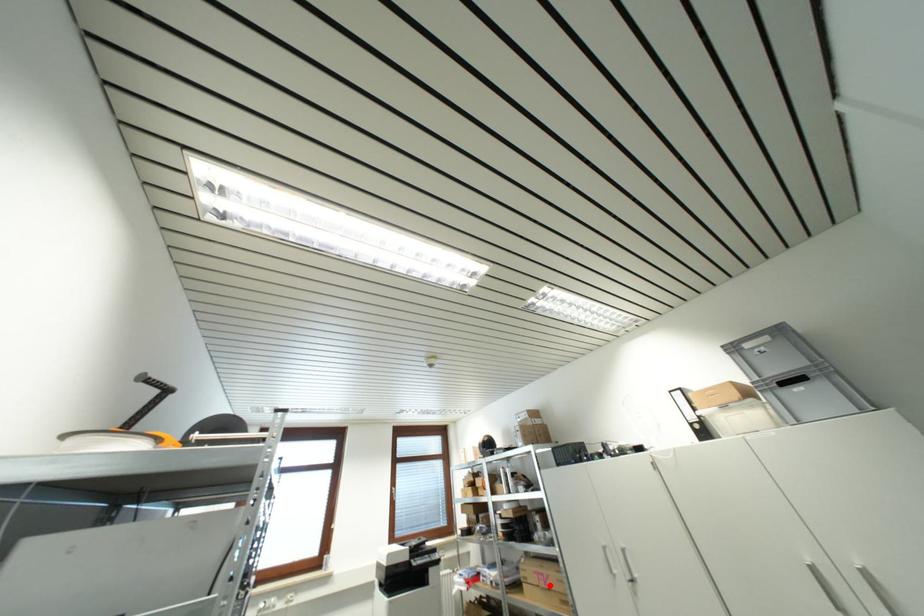
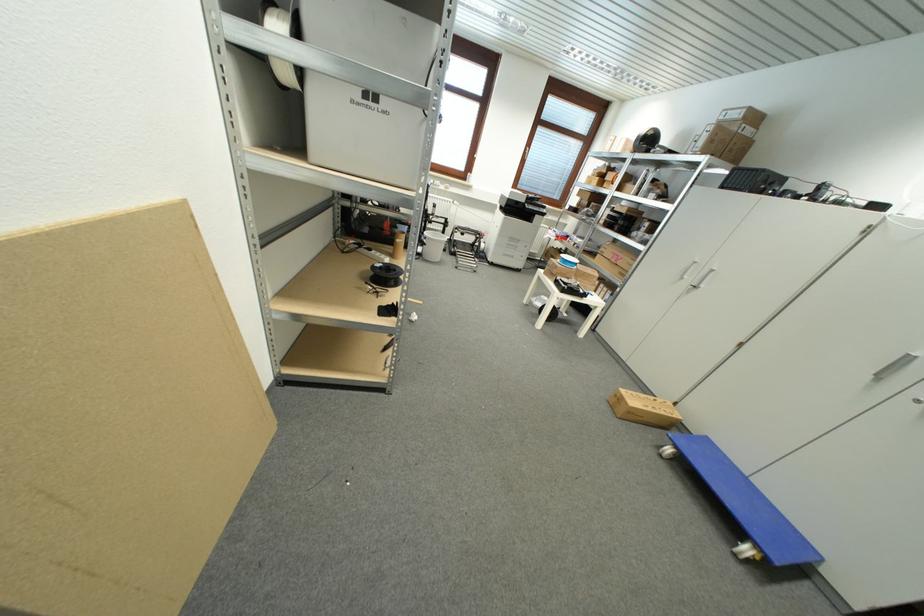
Question: I am providing you with two images of the same scene from different viewpoints. A red point is marked on the first image. Is the red point's position out of view in image 2?

Choices:
 (A) Yes
 (B) No

Answer: (B)